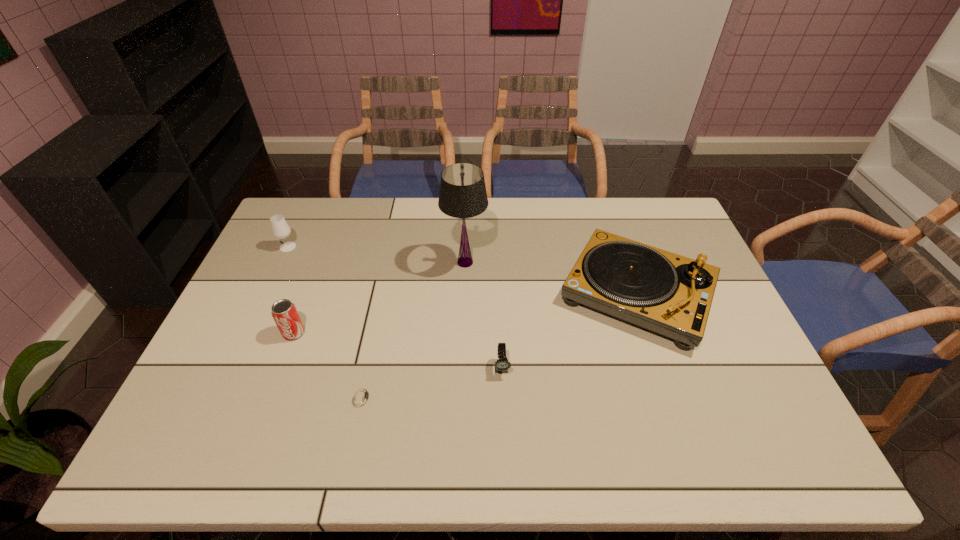
The width and height of the screenshot is (960, 540). What are the coordinates of `free space located 0.290m on the right of the glass` in the screenshot? It's located at (382, 247).

In order to click on free region located on the front of the rightmost object in this screenshot , I will do `click(684, 430)`.

At what (x,y) coordinates should I click in order to perform the action: click on vacant space located 0.350m on the right of the soda can. Please return your answer as a coordinate pair (x, y). Image resolution: width=960 pixels, height=540 pixels. Looking at the image, I should click on (430, 333).

The image size is (960, 540). What are the coordinates of `vacant space situated on the face of the taller watch` in the screenshot? It's located at pyautogui.click(x=504, y=423).

Find the location of `free spot located on the face of the shorter watch`. free spot located on the face of the shorter watch is located at coordinates (504, 397).

At what (x,y) coordinates should I click in order to perform the action: click on object positioned at the left edge. Please return your answer as a coordinate pair (x, y). The image size is (960, 540). Looking at the image, I should click on [280, 228].

Identify the location of object present at the right edge. Image resolution: width=960 pixels, height=540 pixels. (669, 294).

Find the location of a particular element. Image resolution: width=960 pixels, height=540 pixels. free space at the far edge of the desktop is located at coordinates (607, 211).

Where is `vacant region at the near edge of the desktop`? This screenshot has width=960, height=540. vacant region at the near edge of the desktop is located at coordinates (297, 442).

The image size is (960, 540). In the image, there is a desktop. Identify the location of vacant space at the left edge. (233, 419).